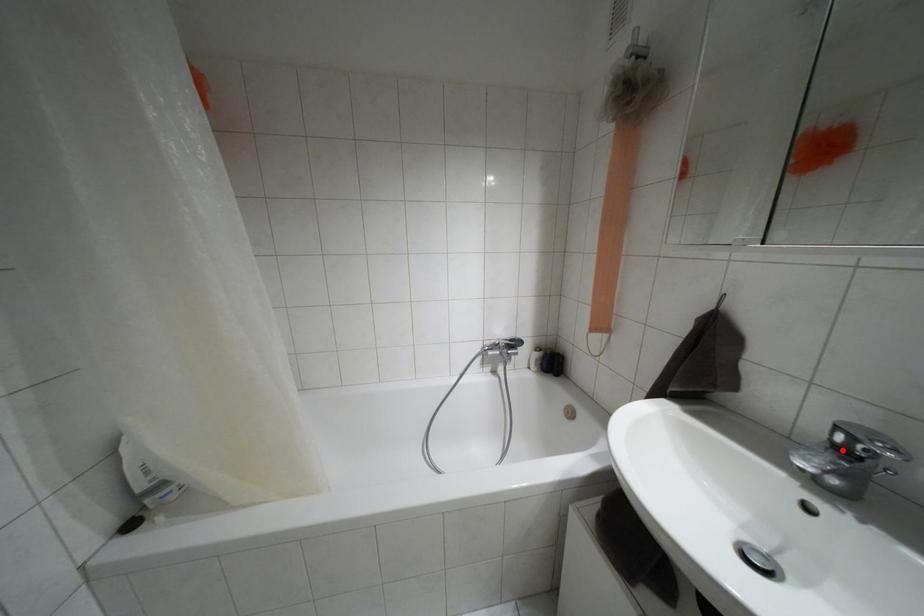
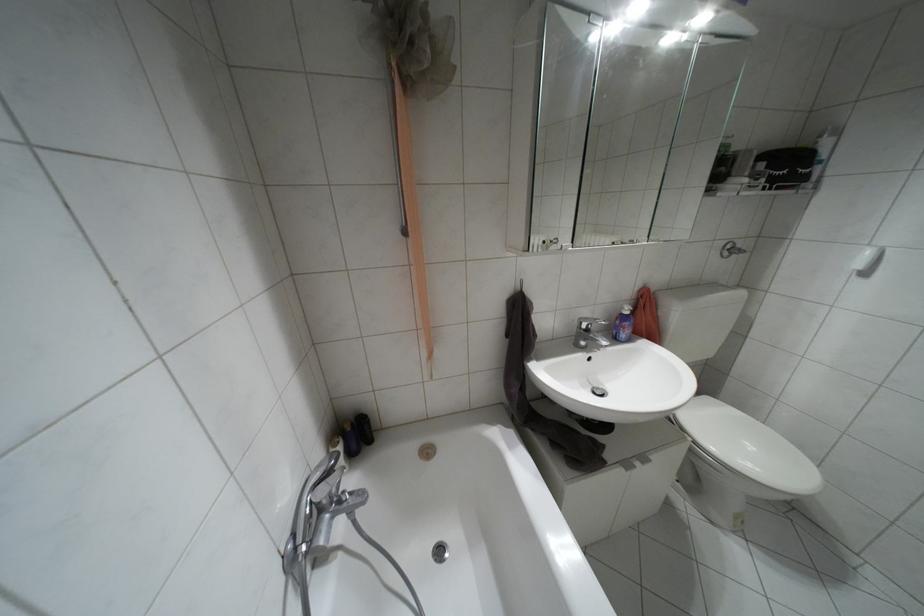
Where in the second image is the point corresponding to the highlighted location from the first image?

(587, 330)